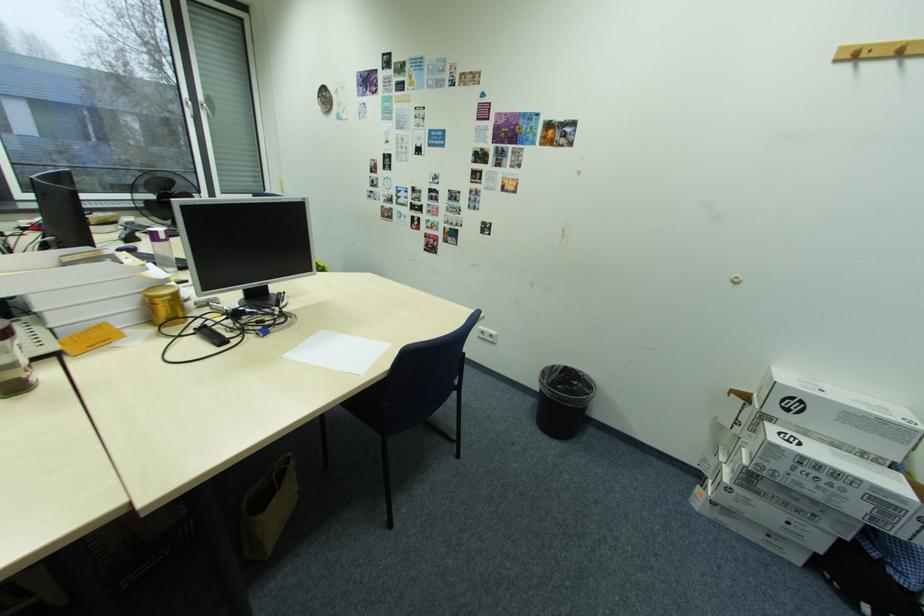
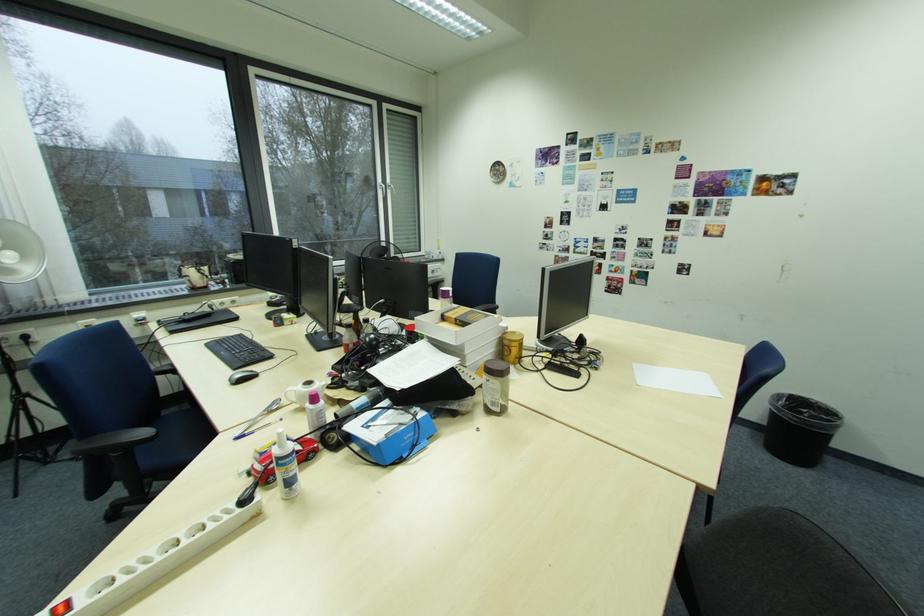
Question: In a continuous first-person perspective shot, in which direction is the camera moving?

Choices:
 (A) Left
 (B) Right
 (C) Forward
 (D) Backward

Answer: (A)